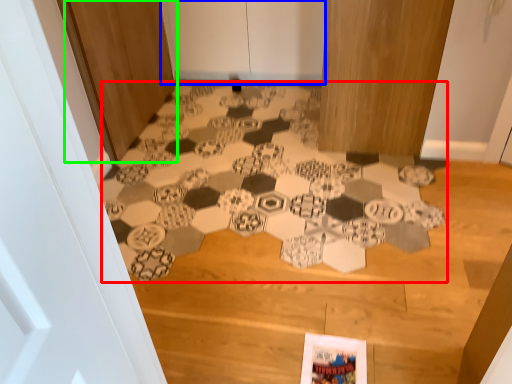
Question: Which object is the closest to the print (highlighted by a red box)? Choose among these: door (highlighted by a blue box) or door (highlighted by a green box).

Choices:
 (A) door
 (B) door

Answer: (B)